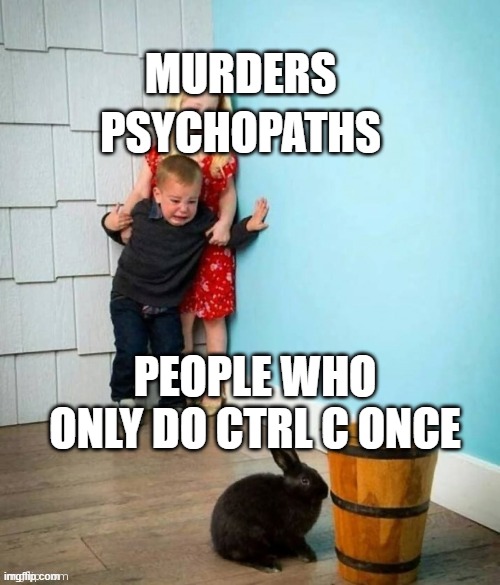
Find the location of a particular element. The height and width of the screenshot is (585, 500). blank blue wall is located at coordinates (411, 220).